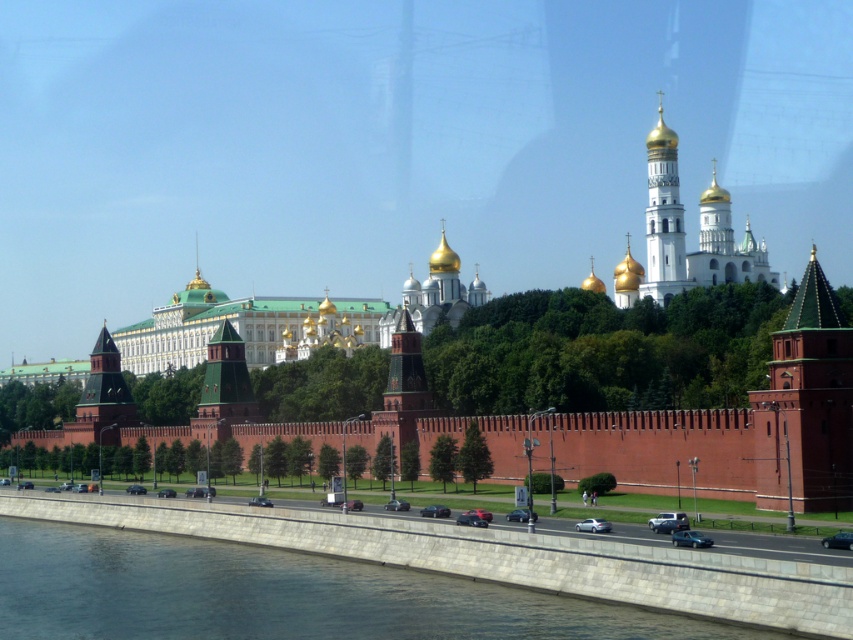
Does gray concrete river at lower left have a greater width compared to green wooden tower at center?

Yes.

Where is `gray concrete river at lower left`? gray concrete river at lower left is located at coordinates (279, 595).

Which of these two, gray concrete river at lower left or brick tower at right, stands taller?

brick tower at right is taller.

Where is `gray concrete river at lower left`? The width and height of the screenshot is (853, 640). gray concrete river at lower left is located at coordinates (279, 595).

Where is `gray concrete river at lower left`? The image size is (853, 640). gray concrete river at lower left is located at coordinates (279, 595).

Does gray concrete river at lower left lie in front of white stone tower at upper center?

Yes.

Between gray concrete river at lower left and white stone tower at upper center, which one is positioned lower?

Positioned lower is gray concrete river at lower left.

What do you see at coordinates (279, 595) in the screenshot?
I see `gray concrete river at lower left` at bounding box center [279, 595].

The image size is (853, 640). Identify the location of gray concrete river at lower left. (279, 595).